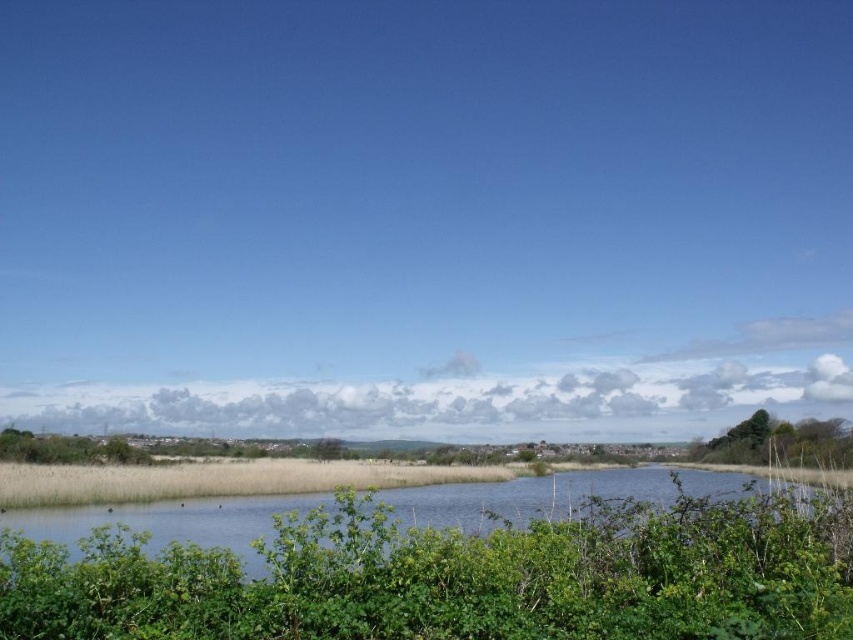
You are a hiker who needs to cross the green grassy river at center. You have a 20 meter rope. Can you use the rope to reach the green leafy bush at right from the river?

The distance between the green grassy river at center and the green leafy bush at right is 18.73 meters. Since the rope is 20 meters long, it is long enough to span the distance between them. Therefore, you can use the rope to reach the green leafy bush at right from the green grassy river at center.